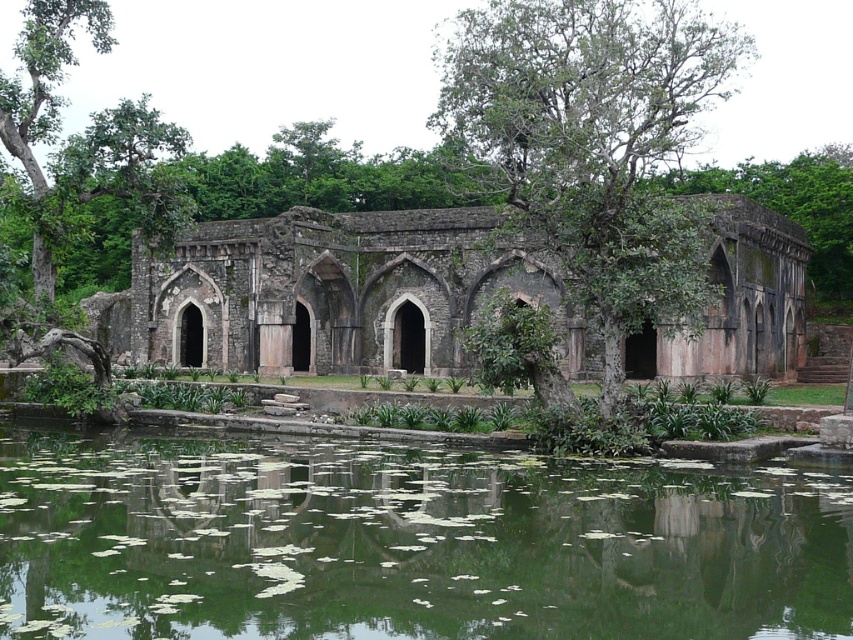
You are standing in front of the ancient stone structure and want to take a photo of both the green reflective water at center and the rustic stone building at center. Which object should you focus on first to ensure both are in sharp focus?

You should focus on the rustic stone building at center first because it is farther away than the green reflective water at center, so adjusting focus from far to near can help ensure both are in sharp focus.

You are an archaeologist examining the ancient stone structure. You notice the green reflective water at center and the green leafy tree at center. Which of these two elements occupies a larger area in the scene?

The green leafy tree at center occupies a larger area in the scene compared to the green reflective water at center.

From the picture: You are an architect visiting the ancient stone structure. You notice the green leafy tree at center and the rustic stone building at center. Which one appears narrower in the scene?

The green leafy tree at center has a lesser width compared to rustic stone building at center, so it appears narrower.